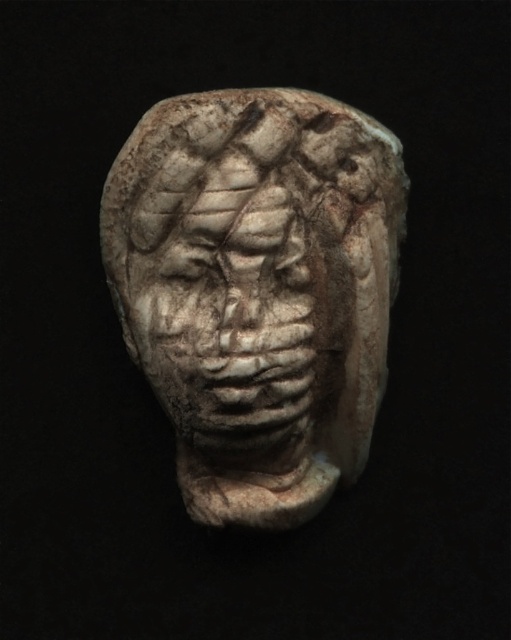
You are an archaeologist examining two stone carvings in the image. The white stone head at center and the gray stone face at center. Which one do you think is bigger?

The white stone head at center is larger in size than the gray stone face at center.

You are an archaeologist examining a stone sculpture. You notice two parts of the sculpture labeled as the white stone head at center and the gray stone face at center. Which part is closer to you?

The white stone head at center is closer to you than the gray stone face at center.

You are an archaeologist examining a stone carving. You notice two parts of the carving labeled as the white stone head at center and the gray stone face at center. Based on their positions and the scene description, which part is more likely to have a wider structure?

The white stone head at center might be wider than gray stone face at center according to the objects description.